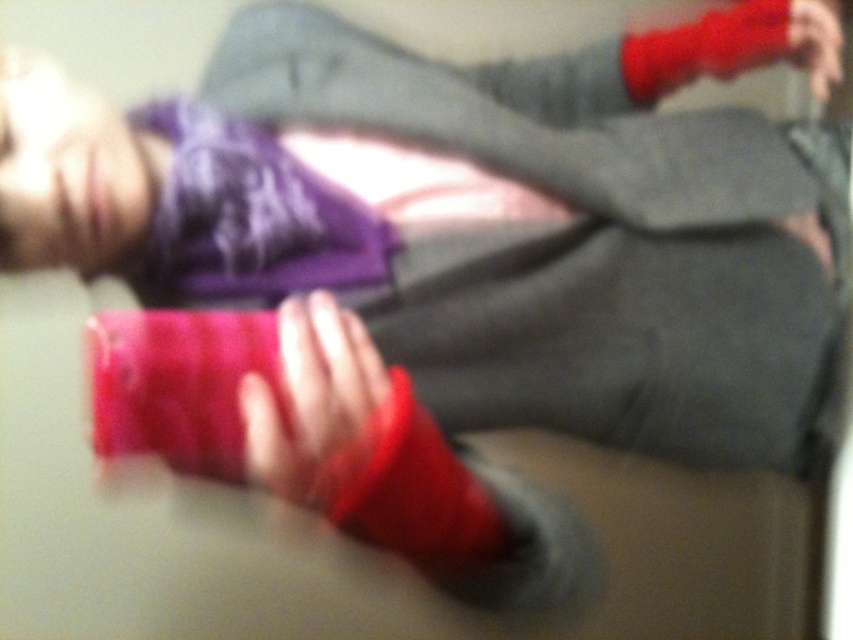
Based on the photo, you are a photographer trying to capture a closeup shot of the person in the scene. You need to ensure that both the matte red sock at center and the matte red sock at upper right are in focus. Given that your camera can only focus on objects within a 20 inch range, will both socks be in focus?

The matte red sock at center is 22.99 inches away from the matte red sock at upper right, which exceeds the camera focus range of 20 inches. Therefore, both socks cannot be in focus simultaneously.

You are a photographer analyzing the image and want to determine which of the two points, point (397, 253) or point (334, 451), is closer to the camera. Based on the spatial relationships in the scene, which point is closer?

Point (397, 253) is further to the viewer than point (334, 451). Therefore, point (334, 451) is closer to the camera.

You are a fashion designer looking at the image of a person wearing matte gray pants at center and matte red sock at upper right. Which item of clothing is bigger in size?

The matte gray pants at center has a larger size compared to the matte red sock at upper right.